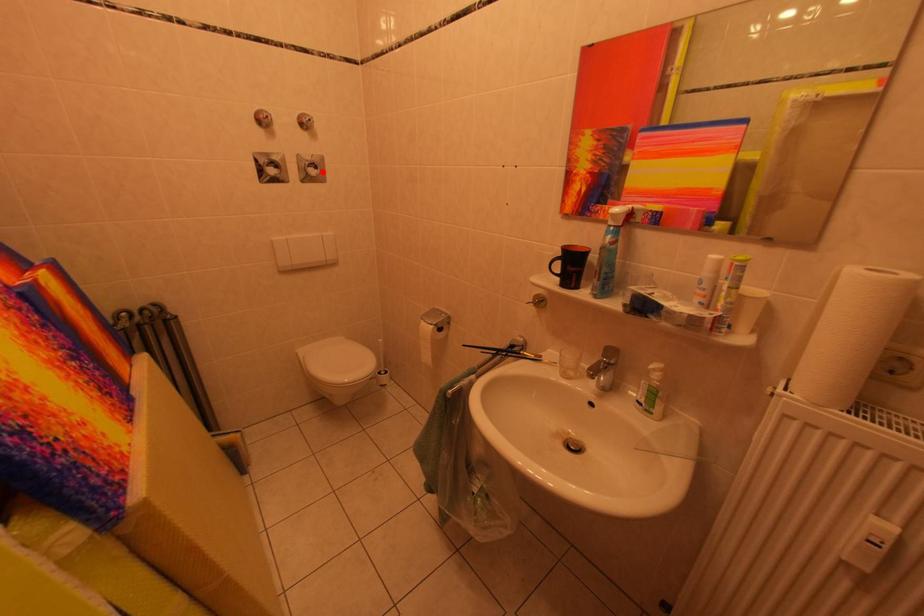
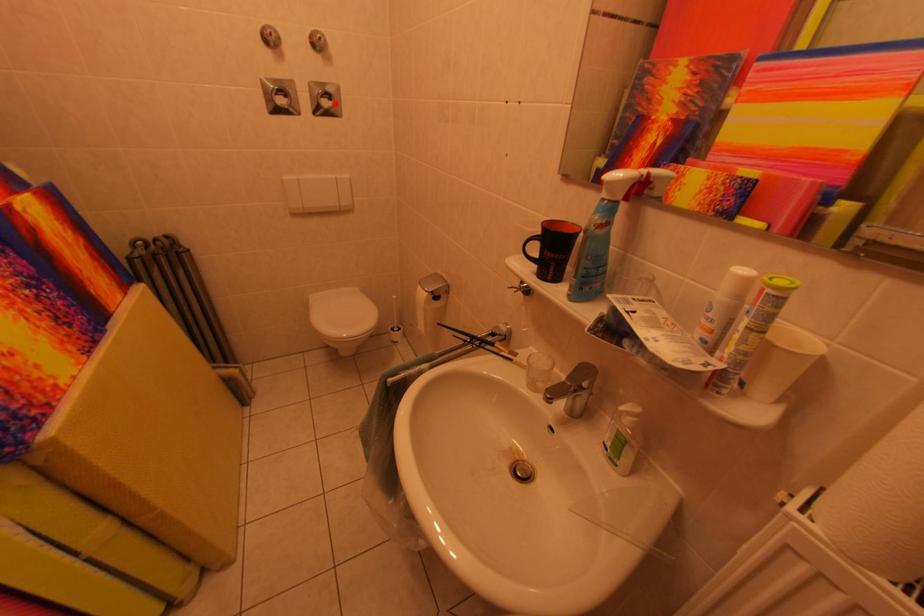
I am providing you with two images of the same scene from different viewpoints. A red point is marked on the first image and another point is marked on the second image. Is the marked point in image1 the same physical position as the marked point in image2?

Yes